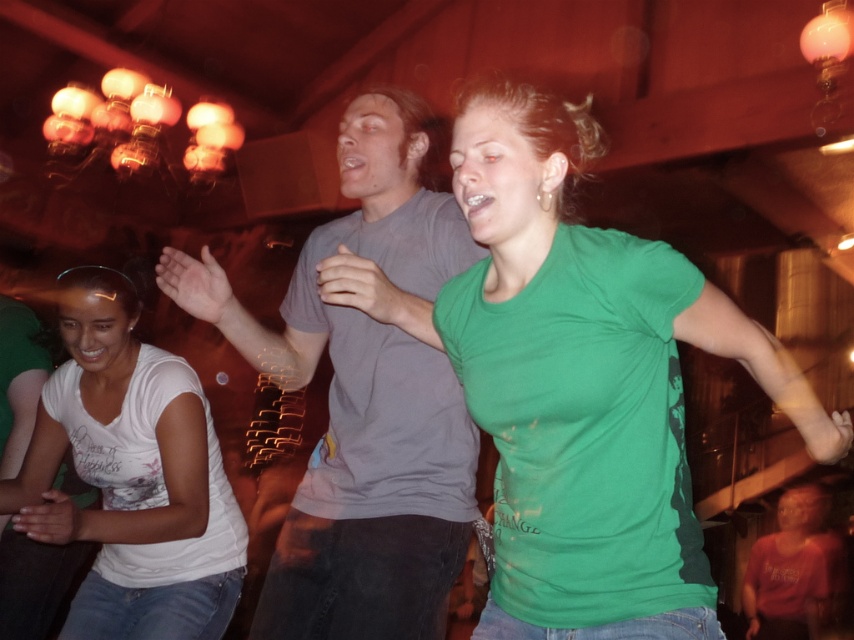
Between green matte t-shirt at center and gray matte t-shirt at center, which one has less height?

With less height is green matte t-shirt at center.

Between green matte t-shirt at center and gray matte t-shirt at center, which one is positioned lower?

gray matte t-shirt at center

Image resolution: width=854 pixels, height=640 pixels. Describe the element at coordinates (578, 381) in the screenshot. I see `green matte t-shirt at center` at that location.

Identify the location of green matte t-shirt at center. (578, 381).

In the scene shown: Does green matte t-shirt at center have a greater height compared to white cotton shirt at lower left?

Incorrect, green matte t-shirt at center's height is not larger of white cotton shirt at lower left's.

Does point (662, 250) come in front of point (85, 300)?

Yes, it is.

Who is more distant from viewer, (726, 328) or (101, 532)?

The point (101, 532) is behind.

Find the location of a particular element. The height and width of the screenshot is (640, 854). green matte t-shirt at center is located at coordinates (578, 381).

Locate an element on the screen. This screenshot has width=854, height=640. gray matte t-shirt at center is located at coordinates (363, 401).

Is gray matte t-shirt at center to the right of white cotton shirt at lower left from the viewer's perspective?

Yes, gray matte t-shirt at center is to the right of white cotton shirt at lower left.

Describe the element at coordinates (363, 401) in the screenshot. I see `gray matte t-shirt at center` at that location.

Locate an element on the screen. Image resolution: width=854 pixels, height=640 pixels. gray matte t-shirt at center is located at coordinates (363, 401).